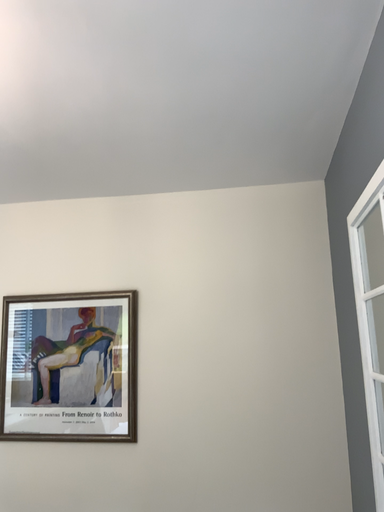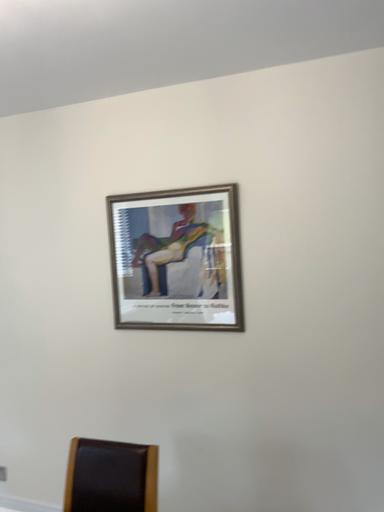
Question: Which way did the camera rotate in the video?

Choices:
 (A) rotated left
 (B) rotated right

Answer: (A)